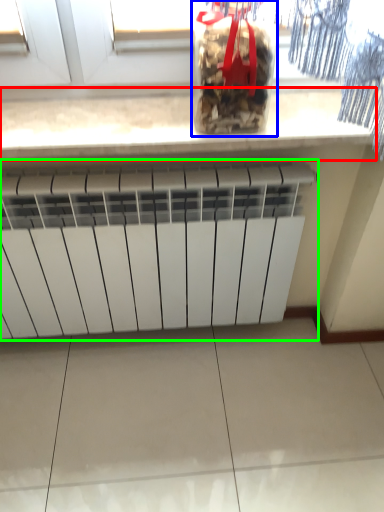
Question: Considering the real-world distances, which object is farthest from countertop (highlighted by a red box)? wine bottle (highlighted by a blue box) or radiator (highlighted by a green box)?

Choices:
 (A) wine bottle
 (B) radiator

Answer: (B)